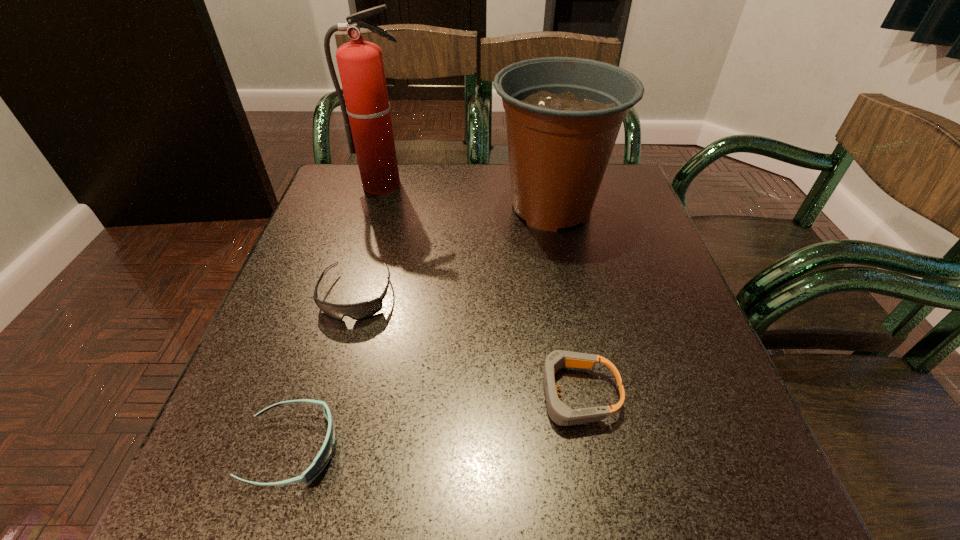
The height and width of the screenshot is (540, 960). I want to click on vacant space at the left edge, so click(x=379, y=214).

In the image, there is a desktop. Where is `vacant space at the right edge`? Image resolution: width=960 pixels, height=540 pixels. vacant space at the right edge is located at coordinates (667, 353).

This screenshot has width=960, height=540. I want to click on free space at the near left corner of the desktop, so click(274, 472).

The image size is (960, 540). In order to click on vacant area between the fire extinguisher and the rightmost goggles in this screenshot , I will do `click(480, 289)`.

Where is `vacant area between the rightmost goggles and the tallest object`? The width and height of the screenshot is (960, 540). vacant area between the rightmost goggles and the tallest object is located at coordinates (x=480, y=289).

Where is `free space between the flowerpot and the third farthest object`? This screenshot has height=540, width=960. free space between the flowerpot and the third farthest object is located at coordinates (454, 252).

Locate an element on the screen. The height and width of the screenshot is (540, 960). free space between the fire extinguisher and the third farthest object is located at coordinates (370, 240).

The width and height of the screenshot is (960, 540). Find the location of `vacant area that lies between the fire extinguisher and the third nearest object`. vacant area that lies between the fire extinguisher and the third nearest object is located at coordinates (370, 240).

The image size is (960, 540). Identify the location of vacant area that lies between the fire extinguisher and the third farthest object. (370, 240).

You are a GUI agent. You are given a task and a screenshot of the screen. Output one action in this format:
    pyautogui.click(x=<x>, y=<y>)
    Task: Click on the object that is the second closest one to the tallest object
    The height and width of the screenshot is (540, 960).
    Given the screenshot: What is the action you would take?
    click(363, 310)